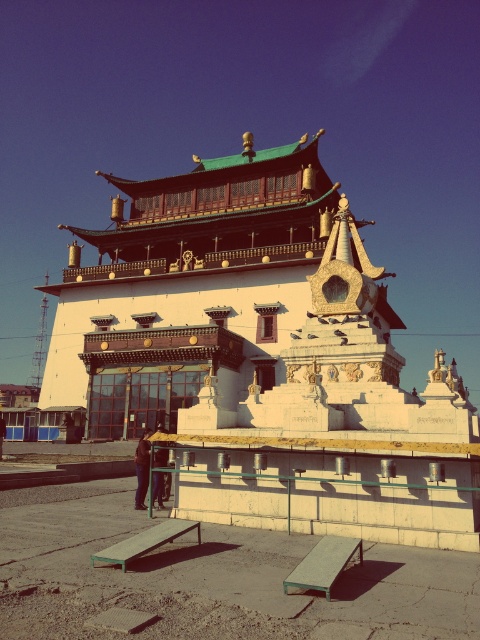
You are planning to place a 1.5 meter long picnic basket on the green matte picnic table at lower center. The dark brown leather jacket at lower center is currently occupying space on the table. Can you fit the picnic basket on the table without moving the jacket?

The green matte picnic table at lower center and dark brown leather jacket at lower center are 15.83 meters apart. Since the jacket is 15.83 meters away from the table, it is not occupying space on the table. Therefore, the picnic basket can be placed on the table without moving the jacket.

You are planning to place a 64.58 feet long banner between the green painted wood picnic table at lower center and the dark brown leather jacket at lower center. Will the banner fit perfectly between them?

The green painted wood picnic table at lower center and dark brown leather jacket at lower center are 64.58 feet apart from each other, so the banner will fit perfectly between them.

You are standing at the entrance of the building and want to sit down at the green painted wood picnic table at lower center. According to the coordinates provided, in which direction should you walk from the entrance to reach the table?

The green painted wood picnic table at lower center is located at coordinates (324,563). Since the entrance is at the front of the building, you should walk forward towards the lower center area to reach the table.